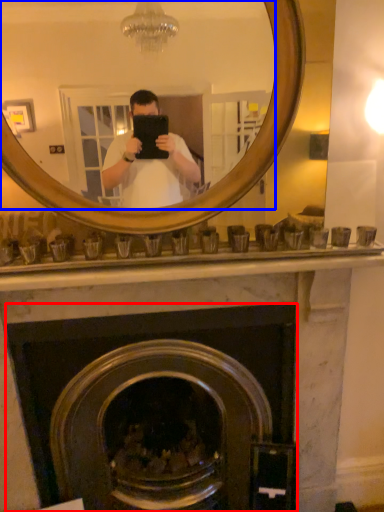
Question: Which of the following is the farthest to the observer, fireplace (highlighted by a red box) or mirror (highlighted by a blue box)?

Choices:
 (A) fireplace
 (B) mirror

Answer: (A)